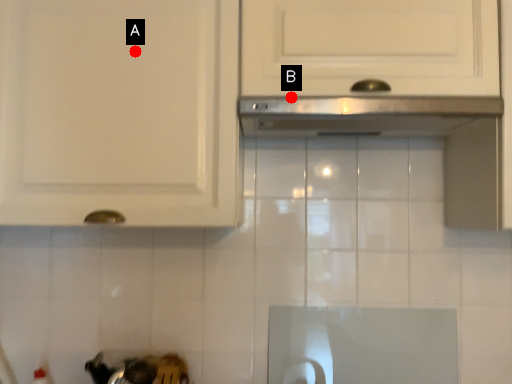
Question: Two points are circled on the image, labeled by A and B beside each circle. Which point is closer to the camera taking this photo?

Choices:
 (A) A is closer
 (B) B is closer

Answer: (B)